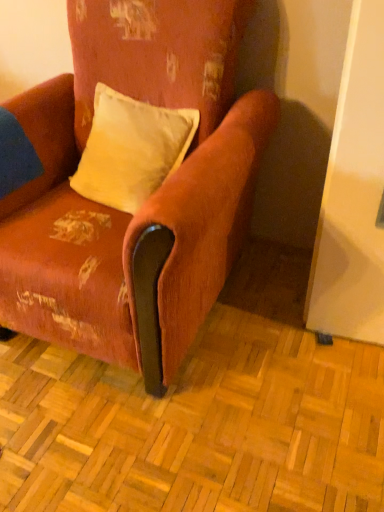
Question: Is velvet-like orange armchair at center in front of velvet yellow pillow at center?

Choices:
 (A) yes
 (B) no

Answer: (A)

Question: Is velvet-like orange armchair at center wider than velvet yellow pillow at center?

Choices:
 (A) no
 (B) yes

Answer: (B)

Question: Is velvet yellow pillow at center a part of velvet-like orange armchair at center?

Choices:
 (A) no
 (B) yes

Answer: (B)

Question: Considering the relative sizes of velvet-like orange armchair at center and velvet yellow pillow at center in the image provided, is velvet-like orange armchair at center smaller than velvet yellow pillow at center?

Choices:
 (A) no
 (B) yes

Answer: (A)

Question: Does velvet-like orange armchair at center have a greater height compared to velvet yellow pillow at center?

Choices:
 (A) no
 (B) yes

Answer: (B)

Question: Can you confirm if velvet-like orange armchair at center is shorter than velvet yellow pillow at center?

Choices:
 (A) no
 (B) yes

Answer: (A)

Question: From a real-world perspective, is velvet yellow pillow at center positioned under velvet-like orange armchair at center based on gravity?

Choices:
 (A) yes
 (B) no

Answer: (B)

Question: Is velvet yellow pillow at center shorter than velvet-like orange armchair at center?

Choices:
 (A) no
 (B) yes

Answer: (B)

Question: Is velvet yellow pillow at center further to the viewer compared to velvet-like orange armchair at center?

Choices:
 (A) yes
 (B) no

Answer: (A)

Question: Are velvet yellow pillow at center and velvet-like orange armchair at center beside each other?

Choices:
 (A) yes
 (B) no

Answer: (B)

Question: Considering the relative sizes of velvet yellow pillow at center and velvet-like orange armchair at center in the image provided, is velvet yellow pillow at center smaller than velvet-like orange armchair at center?

Choices:
 (A) yes
 (B) no

Answer: (A)

Question: Is there a large distance between velvet yellow pillow at center and velvet-like orange armchair at center?

Choices:
 (A) no
 (B) yes

Answer: (A)

Question: Is point (205, 269) closer or farther from the camera than point (153, 174)?

Choices:
 (A) closer
 (B) farther

Answer: (A)